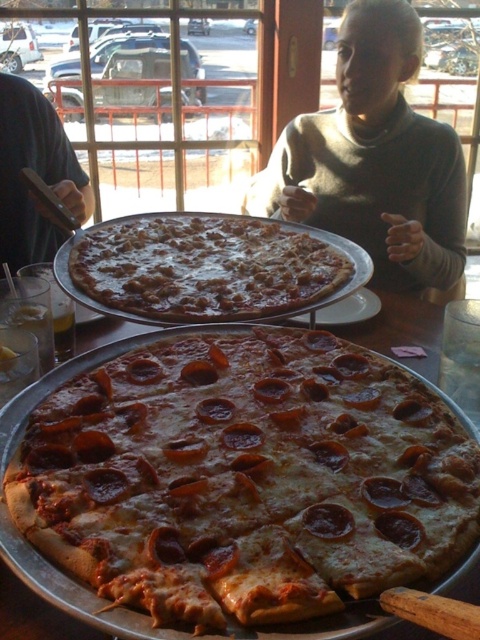
Question: Considering the relative positions of cheesy pepperoni pizza at center and slightly browned cheese pizza at center in the image provided, where is cheesy pepperoni pizza at center located with respect to slightly browned cheese pizza at center?

Choices:
 (A) left
 (B) right

Answer: (B)

Question: Is cheesy pepperoni pizza at center closer to camera compared to slightly browned cheese pizza at center?

Choices:
 (A) yes
 (B) no

Answer: (A)

Question: Does cheesy pepperoni pizza at center appear under slightly browned cheese pizza at center?

Choices:
 (A) yes
 (B) no

Answer: (A)

Question: Which point appears closest to the camera in this image?

Choices:
 (A) (69, 588)
 (B) (322, 296)

Answer: (A)